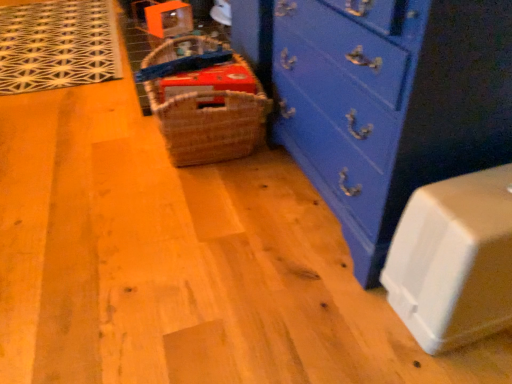
Question: Considering the relative positions of white plastic container at lower right and blue painted wood chest of drawers at center in the image provided, is white plastic container at lower right to the left of blue painted wood chest of drawers at center from the viewer's perspective?

Choices:
 (A) no
 (B) yes

Answer: (A)

Question: Considering the relative sizes of white plastic container at lower right and blue painted wood chest of drawers at center in the image provided, is white plastic container at lower right bigger than blue painted wood chest of drawers at center?

Choices:
 (A) no
 (B) yes

Answer: (A)

Question: Is white plastic container at lower right beside blue painted wood chest of drawers at center?

Choices:
 (A) yes
 (B) no

Answer: (B)

Question: Is white plastic container at lower right oriented towards blue painted wood chest of drawers at center?

Choices:
 (A) no
 (B) yes

Answer: (A)

Question: From the image's perspective, would you say white plastic container at lower right is positioned over blue painted wood chest of drawers at center?

Choices:
 (A) no
 (B) yes

Answer: (A)

Question: Would you say white plastic container at lower right is a long distance from blue painted wood chest of drawers at center?

Choices:
 (A) yes
 (B) no

Answer: (B)

Question: Does blue painted wood chest of drawers at center appear on the right side of white plastic container at lower right?

Choices:
 (A) no
 (B) yes

Answer: (A)

Question: Could you tell me if blue painted wood chest of drawers at center is turned towards white plastic container at lower right?

Choices:
 (A) yes
 (B) no

Answer: (B)

Question: Is blue painted wood chest of drawers at center not close to white plastic container at lower right?

Choices:
 (A) yes
 (B) no

Answer: (B)

Question: Considering the relative sizes of blue painted wood chest of drawers at center and white plastic container at lower right in the image provided, is blue painted wood chest of drawers at center bigger than white plastic container at lower right?

Choices:
 (A) yes
 (B) no

Answer: (A)

Question: Is blue painted wood chest of drawers at center turned away from white plastic container at lower right?

Choices:
 (A) yes
 (B) no

Answer: (B)

Question: From a real-world perspective, is blue painted wood chest of drawers at center located beneath white plastic container at lower right?

Choices:
 (A) no
 (B) yes

Answer: (A)

Question: Considering the relative sizes of woven brown basket at center and blue painted wood chest of drawers at center in the image provided, is woven brown basket at center smaller than blue painted wood chest of drawers at center?

Choices:
 (A) yes
 (B) no

Answer: (A)